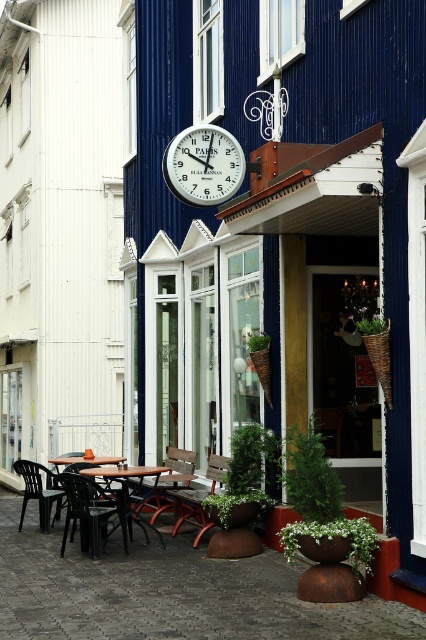
You are a customer entering the cafe and want to sit at the wooden table at center. Which direction should you walk from the wooden table at lower left to reach it?

The wooden table at center is below the wooden table at lower left, so you should walk downward from the wooden table at lower left to reach it.

You are a customer entering the Parisian themed cafe and need to sit at a table. The wooden table at center and the wooden table at lower left are both available. Which table should you choose if you prefer a higher seat?

The wooden table at center has a greater height compared to the wooden table at lower left, so you should choose the wooden table at center for a higher seat.

You are standing at the entrance of the European style cafe and want to sit at the wooden table at center. Which direction should you walk to reach it?

You should walk forward from the entrance to reach the wooden table at center since it is located at point (132, 490), which is directly ahead in the center of the cafe.